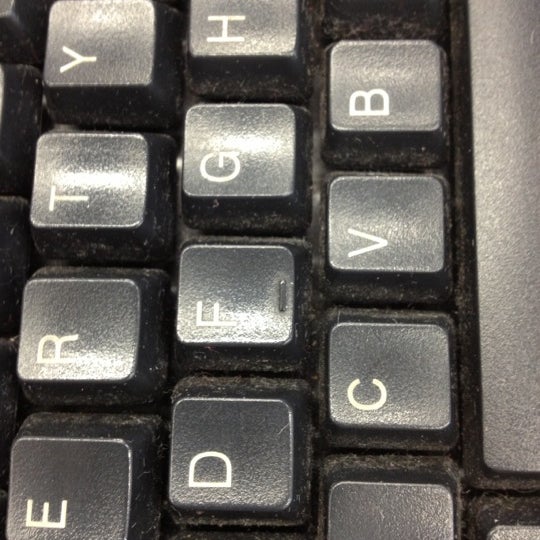
Where is `black keyboard`? black keyboard is located at coordinates (427, 354).